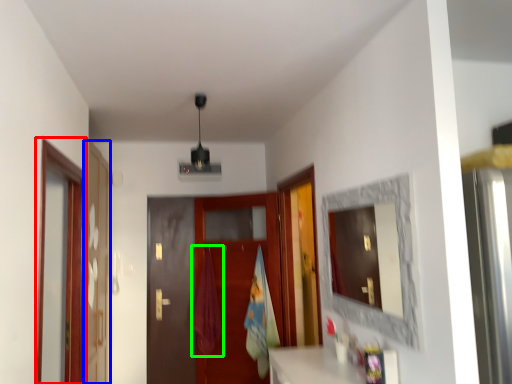
Question: Estimate the real-world distances between objects in this image. Which object is closer to screen door (highlighted by a red box), screen door (highlighted by a blue box) or curtain (highlighted by a green box)?

Choices:
 (A) screen door
 (B) curtain

Answer: (A)